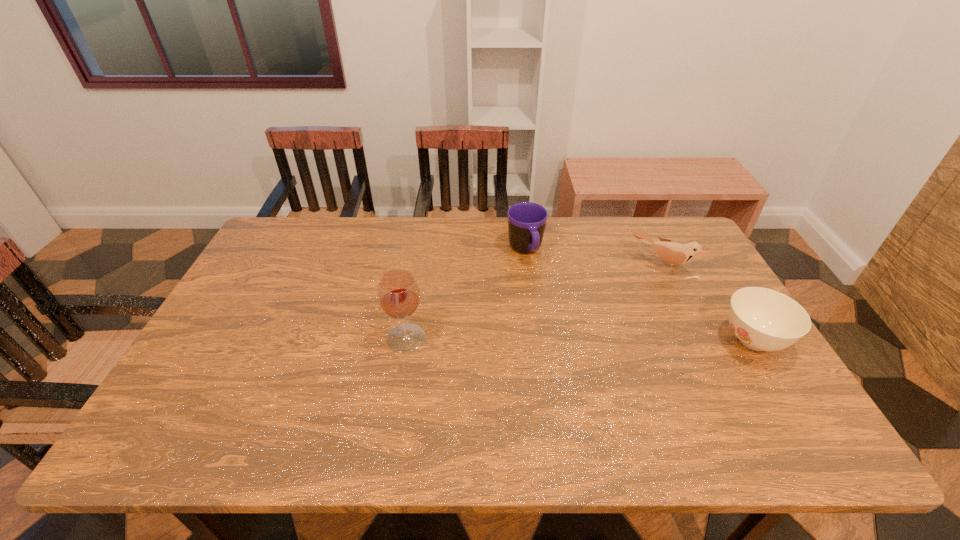
The width and height of the screenshot is (960, 540). In the image, there is a desktop. What are the coordinates of `free region at the left edge` in the screenshot? It's located at click(290, 285).

Locate an element on the screen. vacant space at the far left corner of the desktop is located at coordinates (319, 223).

Identify the location of free space at the near left corner. (220, 412).

Locate an element on the screen. The width and height of the screenshot is (960, 540). vacant space at the near right corner of the desktop is located at coordinates (749, 409).

You are a GUI agent. You are given a task and a screenshot of the screen. Output one action in this format:
    pyautogui.click(x=<x>, y=<y>)
    Task: Click on the empty space that is in between the mug and the sugar bowl
    
    Given the screenshot: What is the action you would take?
    (x=639, y=296)

Find the location of a particular element. unoccupied area between the bird and the mug is located at coordinates (593, 258).

This screenshot has height=540, width=960. I want to click on vacant space in between the wineglass and the third object from right to left, so click(466, 294).

The image size is (960, 540). I want to click on empty space between the second object from left to right and the sugar bowl, so pyautogui.click(x=639, y=296).

Find the location of `free space between the sugar bowl and the bird`. free space between the sugar bowl and the bird is located at coordinates (707, 303).

You are a GUI agent. You are given a task and a screenshot of the screen. Output one action in this format:
    pyautogui.click(x=<x>, y=<y>)
    Task: Click on the blank region between the sugar bowl and the tallest object
    
    Given the screenshot: What is the action you would take?
    pyautogui.click(x=579, y=339)